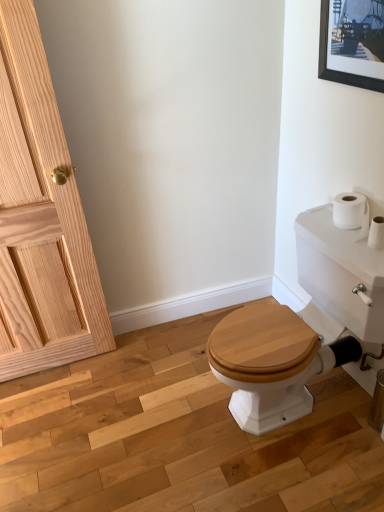
This screenshot has height=512, width=384. What are the coordinates of `vacant space underneath white glossy porcelain at right (from a real-world perspective)` in the screenshot? It's located at (296, 415).